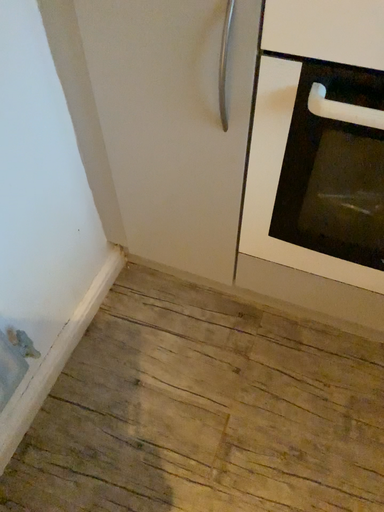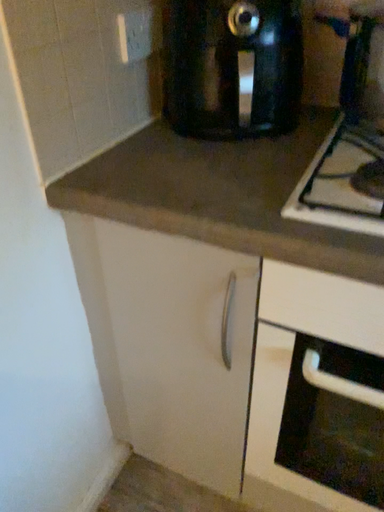
Question: How did the camera likely rotate when shooting the video?

Choices:
 (A) rotated upward
 (B) rotated downward

Answer: (A)